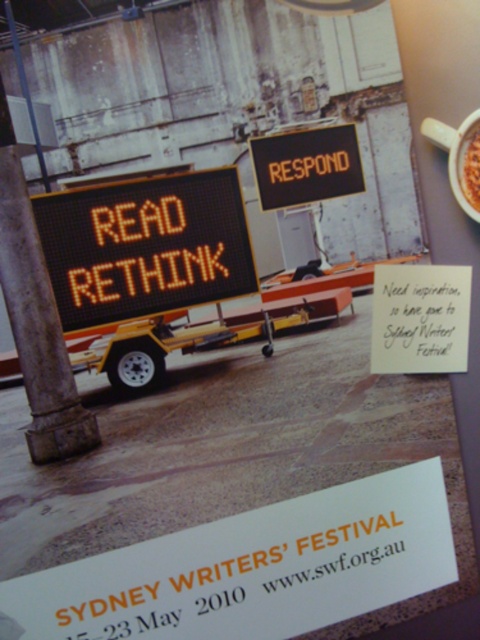
Question: Is orange led sign at center bigger than black matte sign at center?

Choices:
 (A) yes
 (B) no

Answer: (A)

Question: Which of the following is the farthest from the observer?

Choices:
 (A) (475, 202)
 (B) (55, 456)
 (C) (262, 154)

Answer: (C)

Question: Which object is the closest to the brown matte cup at upper right?

Choices:
 (A) gray stone pillar at left
 (B) black matte sign at center
 (C) orange led sign at center
 (D) brown crumbly bread at upper right

Answer: (D)

Question: Which point is closer to the camera?

Choices:
 (A) black matte sign at center
 (B) gray stone pillar at left
 (C) brown crumbly bread at upper right

Answer: (C)

Question: Considering the relative positions of gray stone pillar at left and brown matte cup at upper right in the image provided, where is gray stone pillar at left located with respect to brown matte cup at upper right?

Choices:
 (A) above
 (B) below

Answer: (B)

Question: Can you confirm if gray stone pillar at left is positioned to the right of brown crumbly bread at upper right?

Choices:
 (A) yes
 (B) no

Answer: (B)